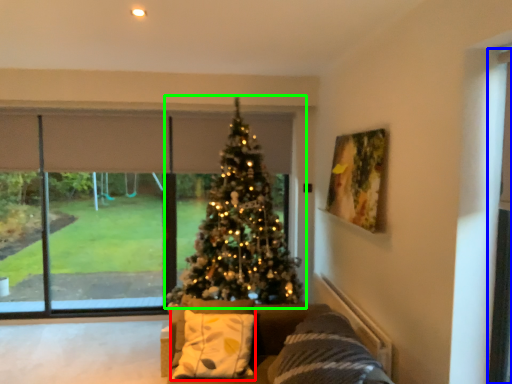
Question: Which object is positioned closest to pillow (highlighted by a red box)? Select from screen door (highlighted by a blue box) and christmas tree (highlighted by a green box).

Choices:
 (A) screen door
 (B) christmas tree

Answer: (B)